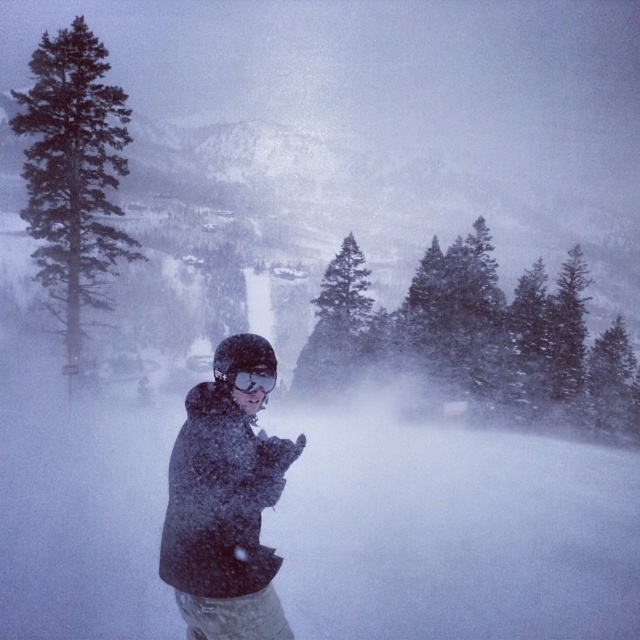
Who is positioned more to the left, dark green textured pine tree at left or matte black goggles at center?

From the viewer's perspective, dark green textured pine tree at left appears more on the left side.

Who is taller, dark green textured pine tree at left or matte black goggles at center?

dark green textured pine tree at left

What do you see at coordinates (74, 176) in the screenshot?
I see `dark green textured pine tree at left` at bounding box center [74, 176].

Find the location of `dark green textured pine tree at left`. dark green textured pine tree at left is located at coordinates (74, 176).

Is dark gray fleece jacket at center bigger than matte black goggles at center?

Yes.

Does dark gray fleece jacket at center appear on the right side of matte black goggles at center?

Incorrect, dark gray fleece jacket at center is not on the right side of matte black goggles at center.

Where is `dark gray fleece jacket at center`? The height and width of the screenshot is (640, 640). dark gray fleece jacket at center is located at coordinates coord(225,504).

Can you confirm if dark gray fleece jacket at center is positioned below dark green textured pine tree at left?

Indeed, dark gray fleece jacket at center is positioned under dark green textured pine tree at left.

Where is `dark gray fleece jacket at center`? dark gray fleece jacket at center is located at coordinates (225, 504).